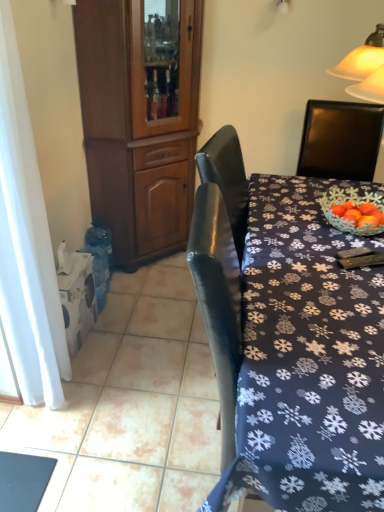
Where is `free space in front of white sheer curtain at left`? The image size is (384, 512). free space in front of white sheer curtain at left is located at coordinates (46, 431).